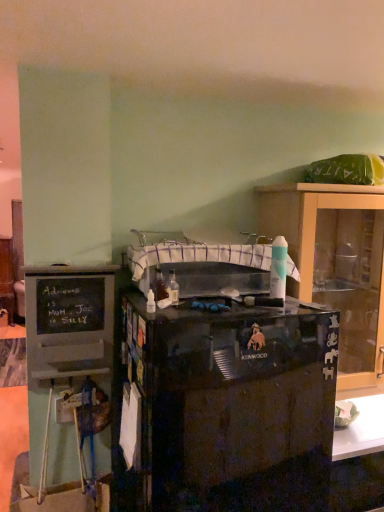
Question: Does black chalkboard cabinet at left, the second cabinetry from the right, have a lesser height compared to white fabric sink at center?

Choices:
 (A) no
 (B) yes

Answer: (A)

Question: Is black chalkboard cabinet at left, which is the 1th cabinetry from front to back, thinner than white fabric sink at center?

Choices:
 (A) no
 (B) yes

Answer: (B)

Question: Does black chalkboard cabinet at left, which is the first cabinetry in left-to-right order, lie in front of white fabric sink at center?

Choices:
 (A) no
 (B) yes

Answer: (A)

Question: From the image's perspective, is black chalkboard cabinet at left, the second cabinetry from the right, under white fabric sink at center?

Choices:
 (A) no
 (B) yes

Answer: (B)

Question: From the image's perspective, is black chalkboard cabinet at left, marked as the 2th cabinetry in a back-to-front arrangement, located above white fabric sink at center?

Choices:
 (A) yes
 (B) no

Answer: (B)

Question: Considering their positions, is matte black kenwood mixer at right, the first cabinetry from the right, located in front of or behind black glossy kenwood mixer at center?

Choices:
 (A) behind
 (B) front

Answer: (A)

Question: In terms of width, does matte black kenwood mixer at right, the 2th cabinetry from the left, look wider or thinner when compared to black glossy kenwood mixer at center?

Choices:
 (A) wide
 (B) thin

Answer: (B)

Question: Is matte black kenwood mixer at right, the 2th cabinetry from the left, situated inside black glossy kenwood mixer at center or outside?

Choices:
 (A) outside
 (B) inside

Answer: (A)

Question: Is matte black kenwood mixer at right, which appears as the second cabinetry when viewed from the front, bigger or smaller than black glossy kenwood mixer at center?

Choices:
 (A) small
 (B) big

Answer: (A)

Question: Which is correct: black chalkboard cabinet at left, which is the 1th cabinetry from front to back, is inside black glossy kenwood mixer at center, or outside of it?

Choices:
 (A) inside
 (B) outside

Answer: (B)

Question: Relative to black glossy kenwood mixer at center, is black chalkboard cabinet at left, which is the 1th cabinetry from front to back, in front or behind?

Choices:
 (A) behind
 (B) front

Answer: (A)

Question: In terms of width, does black chalkboard cabinet at left, which is the first cabinetry in left-to-right order, look wider or thinner when compared to black glossy kenwood mixer at center?

Choices:
 (A) wide
 (B) thin

Answer: (B)

Question: In terms of size, does black chalkboard cabinet at left, which is the 1th cabinetry from front to back, appear bigger or smaller than black glossy kenwood mixer at center?

Choices:
 (A) big
 (B) small

Answer: (B)

Question: From a real-world perspective, is black glossy kenwood mixer at center positioned above or below matte black kenwood mixer at right, the 2th cabinetry from the left?

Choices:
 (A) above
 (B) below

Answer: (B)

Question: In terms of width, does black glossy kenwood mixer at center look wider or thinner when compared to matte black kenwood mixer at right, the 2th cabinetry from the left?

Choices:
 (A) wide
 (B) thin

Answer: (A)